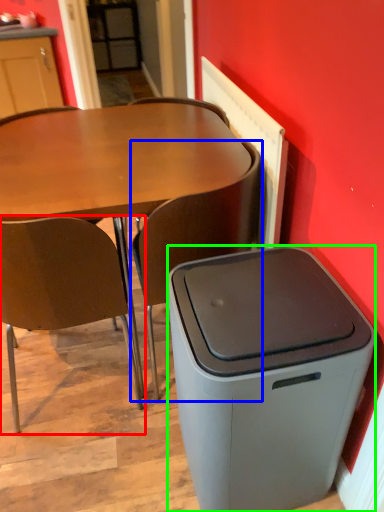
Question: Based on their relative distances, which object is nearer to chair (highlighted by a red box)? Choose from chair (highlighted by a blue box) and trash bin/can (highlighted by a green box).

Choices:
 (A) chair
 (B) trash bin/can

Answer: (A)